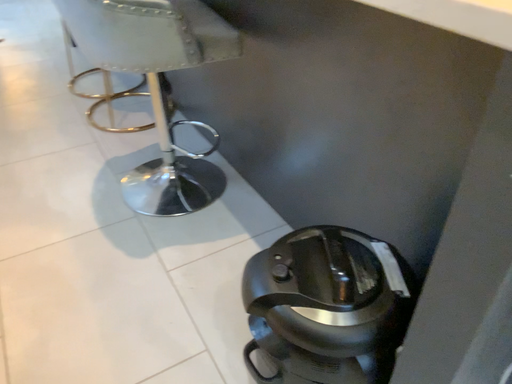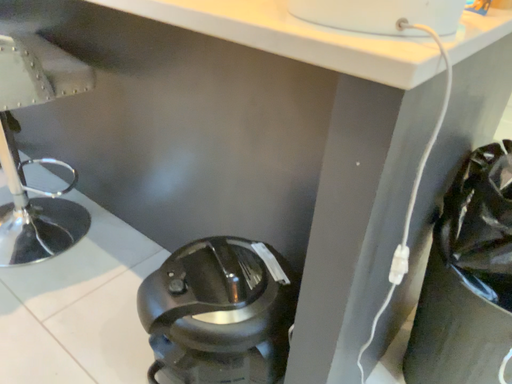
Question: Which way did the camera rotate in the video?

Choices:
 (A) rotated left
 (B) rotated right

Answer: (B)